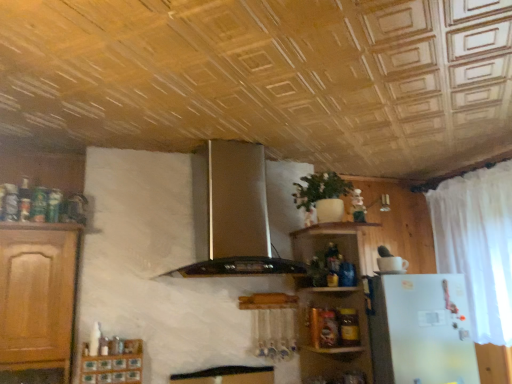
The width and height of the screenshot is (512, 384). Describe the element at coordinates (232, 214) in the screenshot. I see `satin silver exhaust hood at center` at that location.

Describe the element at coordinates (113, 363) in the screenshot. I see `wooden spice rack at lower left` at that location.

Locate an element on the screen. The width and height of the screenshot is (512, 384). satin silver refrigerator at right is located at coordinates (421, 330).

How different are the orientations of wooden shelves at upper right and satin silver exhaust hood at center in degrees?

There is a 3.78-degree angle between the facing directions of wooden shelves at upper right and satin silver exhaust hood at center.

Considering the sizes of objects wooden shelves at upper right and satin silver exhaust hood at center in the image provided, who is shorter, wooden shelves at upper right or satin silver exhaust hood at center?

satin silver exhaust hood at center.

Considering the sizes of objects wooden shelves at upper right and satin silver exhaust hood at center in the image provided, who is wider, wooden shelves at upper right or satin silver exhaust hood at center?

wooden shelves at upper right.

Considering the relative positions of wooden spice rack at lower left and satin silver exhaust hood at center in the image provided, is wooden spice rack at lower left behind satin silver exhaust hood at center?

Yes, the depth of wooden spice rack at lower left is greater than that of satin silver exhaust hood at center.

Can you confirm if wooden spice rack at lower left is positioned to the left of satin silver exhaust hood at center?

Yes, wooden spice rack at lower left is to the left of satin silver exhaust hood at center.

Considering the sizes of objects wooden spice rack at lower left and satin silver exhaust hood at center in the image provided, who is bigger, wooden spice rack at lower left or satin silver exhaust hood at center?

satin silver exhaust hood at center is bigger.

Is wooden spice rack at lower left oriented away from satin silver exhaust hood at center?

No, wooden spice rack at lower left is not facing the opposite direction of satin silver exhaust hood at center.

From a real-world perspective, relative to white sheer curtain at right, is wooden shelves at upper right vertically above or below?

From a real-world perspective, wooden shelves at upper right is physically below white sheer curtain at right.

Considering the relative positions of wooden shelves at upper right and white sheer curtain at right in the image provided, is wooden shelves at upper right in front of white sheer curtain at right?

Yes, the depth of wooden shelves at upper right is less than that of white sheer curtain at right.

Are wooden shelves at upper right and white sheer curtain at right beside each other?

No.

Is satin silver exhaust hood at center turned away from satin silver refrigerator at right?

satin silver exhaust hood at center is not turned away from satin silver refrigerator at right.

Are satin silver exhaust hood at center and satin silver refrigerator at right beside each other?

satin silver exhaust hood at center and satin silver refrigerator at right are clearly separated.

In the scene shown: From a real-world perspective, who is located higher, satin silver exhaust hood at center or satin silver refrigerator at right?

satin silver exhaust hood at center is physically above.

Which is more distant, (252, 155) or (475, 379)?

Positioned behind is point (475, 379).

From a real-world perspective, is satin silver refrigerator at right under wooden shelves at upper right?

Yes, from a real-world perspective, satin silver refrigerator at right is under wooden shelves at upper right.

Is satin silver refrigerator at right facing away from wooden shelves at upper right?

satin silver refrigerator at right is not turned away from wooden shelves at upper right.

Is satin silver refrigerator at right taller than wooden shelves at upper right?

Incorrect, the height of satin silver refrigerator at right is not larger of that of wooden shelves at upper right.

Is wooden shelves at upper right oriented towards green matte plant at center?

No.

Considering the relative sizes of wooden shelves at upper right and green matte plant at center in the image provided, is wooden shelves at upper right taller than green matte plant at center?

Yes.

Can you confirm if wooden shelves at upper right is positioned to the right of green matte plant at center?

Correct, you'll find wooden shelves at upper right to the right of green matte plant at center.

Would you say green matte plant at center is a long distance from satin silver exhaust hood at center?

No.

Is green matte plant at center inside or outside of satin silver exhaust hood at center?

green matte plant at center is not inside satin silver exhaust hood at center, it's outside.

Which point is more distant from viewer, (334, 180) or (211, 171)?

The point (334, 180) is more distant.

Image resolution: width=512 pixels, height=384 pixels. I want to click on exhaust hood on the left of green matte plant at center, so click(x=232, y=214).

This screenshot has width=512, height=384. I want to click on exhaust hood above the wooden shelves at upper right (from a real-world perspective), so [232, 214].

Identify the location of cabinetry that is behind the satin silver exhaust hood at center. The width and height of the screenshot is (512, 384). (113, 363).

Which object lies nearer to the anchor point green matte plant at center, satin silver exhaust hood at center or wooden spice rack at lower left?

satin silver exhaust hood at center is positioned closer to the anchor green matte plant at center.

Based on the photo, when comparing their distances from wooden shelves at upper right, does green matte plant at center or satin silver refrigerator at right seem closer?

Based on the image, satin silver refrigerator at right appears to be nearer to wooden shelves at upper right.

Which object lies further to the anchor point wooden shelves at upper right, green matte plant at center or satin silver exhaust hood at center?

The object further to wooden shelves at upper right is satin silver exhaust hood at center.

Estimate the real-world distances between objects in this image. Which object is closer to white sheer curtain at right, satin silver exhaust hood at center or green matte plant at center?

green matte plant at center lies closer to white sheer curtain at right than the other object.

Looking at the image, which one is located further to wooden shelves at upper right, wooden spice rack at lower left or green matte plant at center?

wooden spice rack at lower left is positioned further to the anchor wooden shelves at upper right.

Which object lies further to the anchor point wooden spice rack at lower left, satin silver refrigerator at right or green matte plant at center?

Among the two, satin silver refrigerator at right is located further to wooden spice rack at lower left.

From the image, which object appears to be nearer to satin silver refrigerator at right, satin silver exhaust hood at center or wooden spice rack at lower left?

satin silver exhaust hood at center is closer to satin silver refrigerator at right.

From the image, which object appears to be farther from wooden shelves at upper right, satin silver exhaust hood at center or satin silver refrigerator at right?

Among the two, satin silver exhaust hood at center is located further to wooden shelves at upper right.

At what (x,y) coordinates should I click in order to perform the action: click on shelf located between satin silver exhaust hood at center and white sheer curtain at right in the left-right direction. Please return your answer as a coordinate pair (x, y). Image resolution: width=512 pixels, height=384 pixels. Looking at the image, I should click on (334, 296).

The image size is (512, 384). Identify the location of exhaust hood between wooden spice rack at lower left and white sheer curtain at right from left to right. (232, 214).

Where is `exhaust hood between wooden spice rack at lower left and wooden shelves at upper right in the horizontal direction`? This screenshot has width=512, height=384. exhaust hood between wooden spice rack at lower left and wooden shelves at upper right in the horizontal direction is located at coordinates tap(232, 214).

In order to click on exhaust hood between wooden spice rack at lower left and green matte plant at center from left to right in this screenshot , I will do `click(232, 214)`.